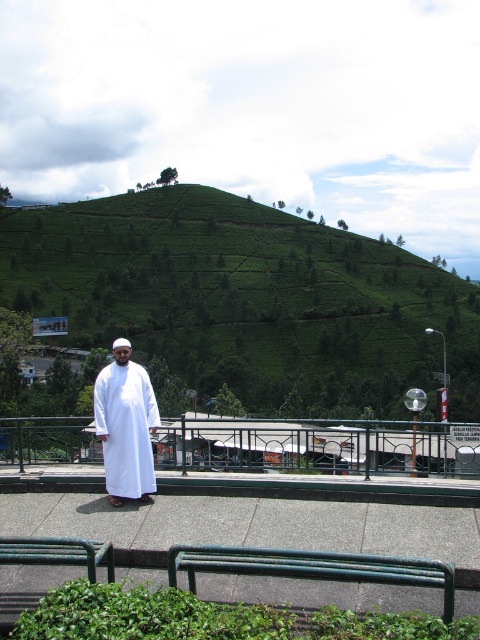
Is the position of green leafy hillside at upper center more distant than that of white cotton robe at center?

Yes.

Is point (20, 248) in front of point (122, 440)?

No, it is behind (122, 440).

I want to click on green leafy hillside at upper center, so click(247, 300).